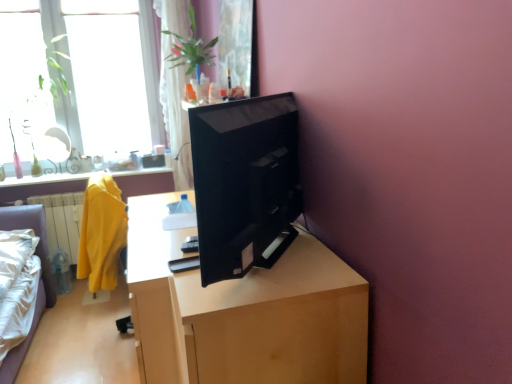
Locate an element on the screen. This screenshot has width=512, height=384. empty space that is ontop of yellow fabric at left is located at coordinates (42, 188).